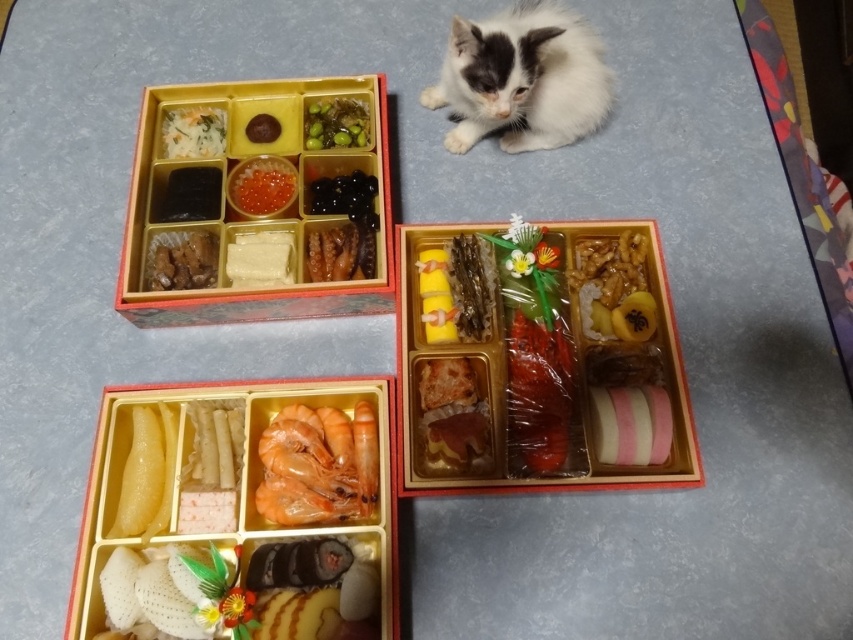
Who is more forward, (254, 164) or (305, 147)?

Point (254, 164)

Between shiny orange caviar at center and green glossy seaweed at upper center, which one appears on the right side from the viewer's perspective?

From the viewer's perspective, green glossy seaweed at upper center appears more on the right side.

Between point (256, 189) and point (337, 140), which one is positioned in front?

Positioned in front is point (256, 189).

The image size is (853, 640). In order to click on shiny orange caviar at center in this screenshot , I will do `click(260, 186)`.

Between shiny pinkish-orange shrimp at lower left and brown glossy dried seaweed at upper left, which one appears on the left side from the viewer's perspective?

Positioned to the left is brown glossy dried seaweed at upper left.

Which is behind, point (305, 460) or point (170, 285)?

Point (170, 285)

Does point (300, 500) come behind point (200, 244)?

No, it is in front of (200, 244).

The height and width of the screenshot is (640, 853). Identify the location of shiny pinkish-orange shrimp at lower left. (318, 465).

Can you confirm if shiny pinkish-orange shrimp at lower left is positioned above pink striped sushi at lower right?

No, shiny pinkish-orange shrimp at lower left is not above pink striped sushi at lower right.

Is the position of shiny pinkish-orange shrimp at lower left less distant than that of pink striped sushi at lower right?

Yes, it is in front of pink striped sushi at lower right.

Which is behind, point (299, 490) or point (592, 408)?

Positioned behind is point (592, 408).

I want to click on shiny pinkish-orange shrimp at lower left, so [318, 465].